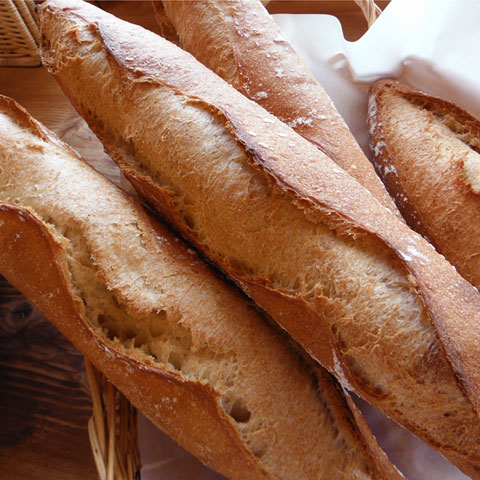
Identify the location of wooden table. The height and width of the screenshot is (480, 480). (79, 128).